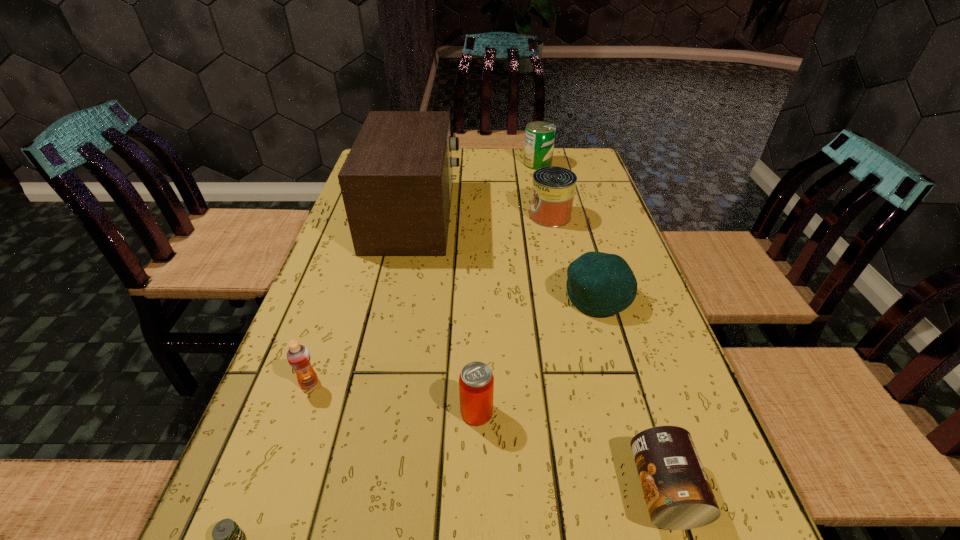
I want to click on vacant area situated on the left of the farthest can, so click(442, 164).

Where is `free space located 0.350m on the front of the second farthest can`? free space located 0.350m on the front of the second farthest can is located at coordinates (572, 320).

You are a GUI agent. You are given a task and a screenshot of the screen. Output one action in this format:
    pyautogui.click(x=<x>, y=<y>)
    Task: Click on the vacant space located 0.100m on the back of the beanie
    
    Given the screenshot: What is the action you would take?
    pyautogui.click(x=584, y=250)

Locate an element on the screen. vacant region located 0.190m on the back of the fourth nearest object is located at coordinates (336, 306).

The height and width of the screenshot is (540, 960). What are the coordinates of `free location located 0.180m on the right of the fourth object from left to right` in the screenshot? It's located at (593, 412).

Locate an element on the screen. free space located on the front label of the nearest can is located at coordinates (531, 490).

I want to click on vacant area located on the front label of the nearest can, so click(x=435, y=490).

What are the coordinates of `free spot located 0.220m on the front label of the nearest can` in the screenshot? It's located at (492, 490).

Where is `object that is at the far edge`? The width and height of the screenshot is (960, 540). object that is at the far edge is located at coordinates (539, 137).

I want to click on radio receiver that is at the left edge, so click(396, 182).